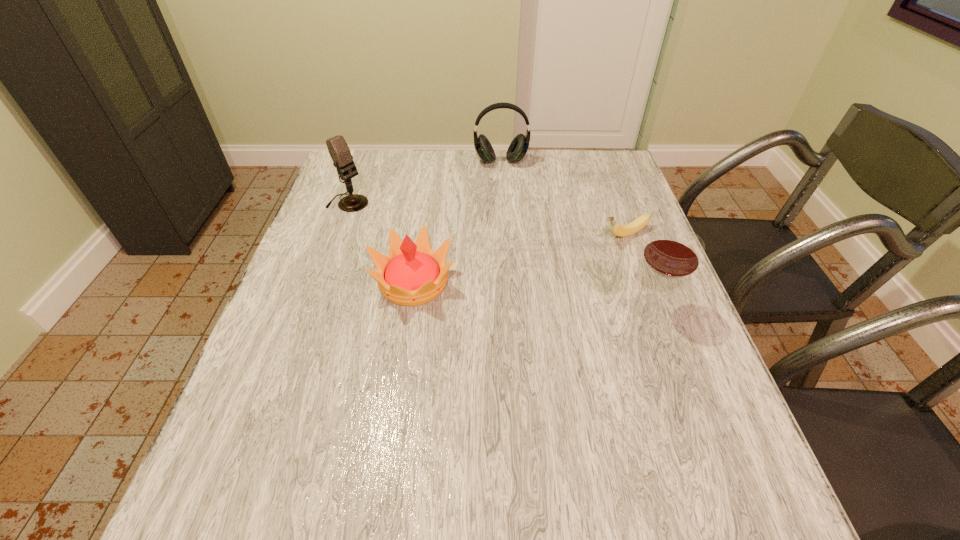
This screenshot has width=960, height=540. I want to click on free area in between the fourth tallest object and the wineglass, so [x=532, y=294].

Where is `blank region between the wineglass and the fourth nearest object`? The height and width of the screenshot is (540, 960). blank region between the wineglass and the fourth nearest object is located at coordinates (499, 255).

Find the location of a particular element. free space that is in between the crown and the third object from right to left is located at coordinates (457, 222).

This screenshot has width=960, height=540. Identify the location of vacant space in between the wineglass and the crown. (532, 294).

Locate an element on the screen. free area in between the fourth object from right to left and the headset is located at coordinates (457, 222).

Identify the location of empty space between the crown and the banana. (519, 258).

Locate an element on the screen. The image size is (960, 540). empty space between the fourth nearest object and the third nearest object is located at coordinates (487, 219).

Find the location of a particular element. The width and height of the screenshot is (960, 540). free space between the microphone and the shortest object is located at coordinates (487, 219).

The width and height of the screenshot is (960, 540). Find the location of `vacant area between the leftmost object and the fourth object from right to left`. vacant area between the leftmost object and the fourth object from right to left is located at coordinates (381, 242).

The image size is (960, 540). I want to click on vacant area between the wineglass and the farthest object, so click(576, 234).